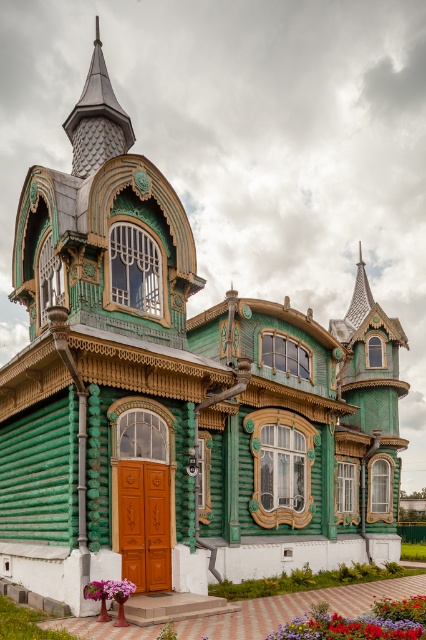
You are a gardener who wants to plant a new flower that needs to be placed between the vivid red petals at lower center and the pink matte flower at lower center. Which flower should you place the new flower closer to if you want it to be taller than both?

You should place the new flower closer to the vivid red petals at lower center because it is much taller than the pink matte flower at lower center, so positioning it near the taller flower increases the likelihood of it growing taller than both.

Looking at this image, you are standing 100 meters away from the wooden house and want to approach it to touch the shiny dark gray spire at upper center. How many more meters do you need to walk to reach it?

The shiny dark gray spire at upper center is 69.62 meters from the viewer. Since you are currently 100 meters away, you need to walk 30.38 meters more to reach it.